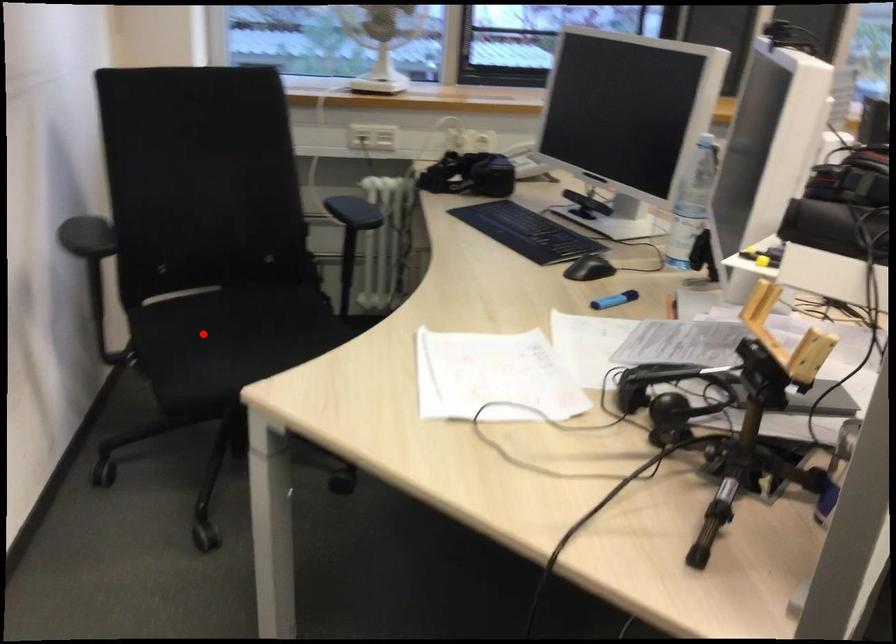
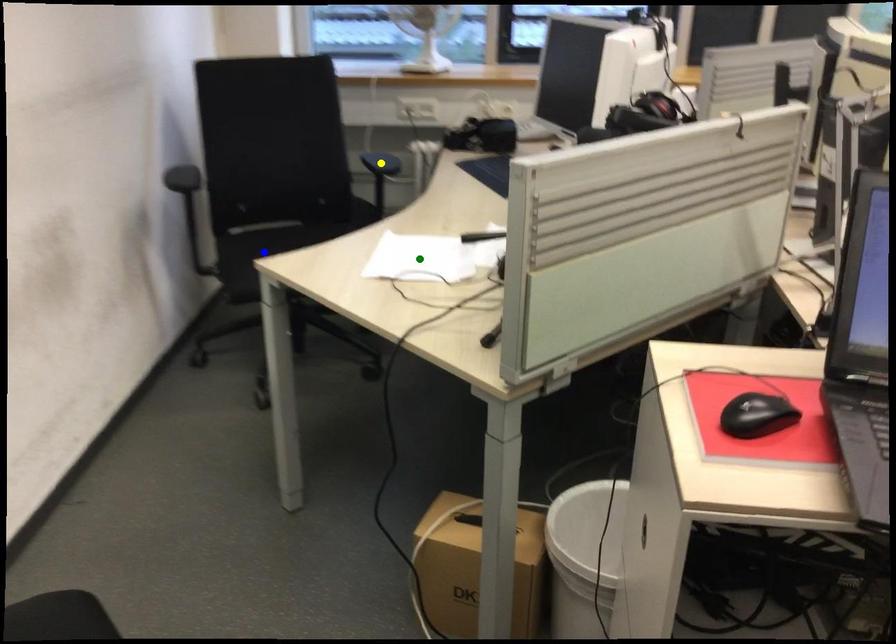
Question: I am providing you with two images of the same scene from different viewpoints. A red point is marked on the first image. You are given multiple points on the second image. Which mark in image 2 goes with the point in image 1?

Choices:
 (A) green point
 (B) yellow point
 (C) blue point

Answer: (C)